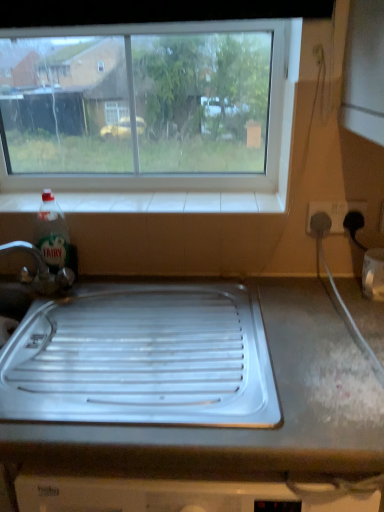
Identify the location of free space in front of green translucent liquid at bottle left. (54, 296).